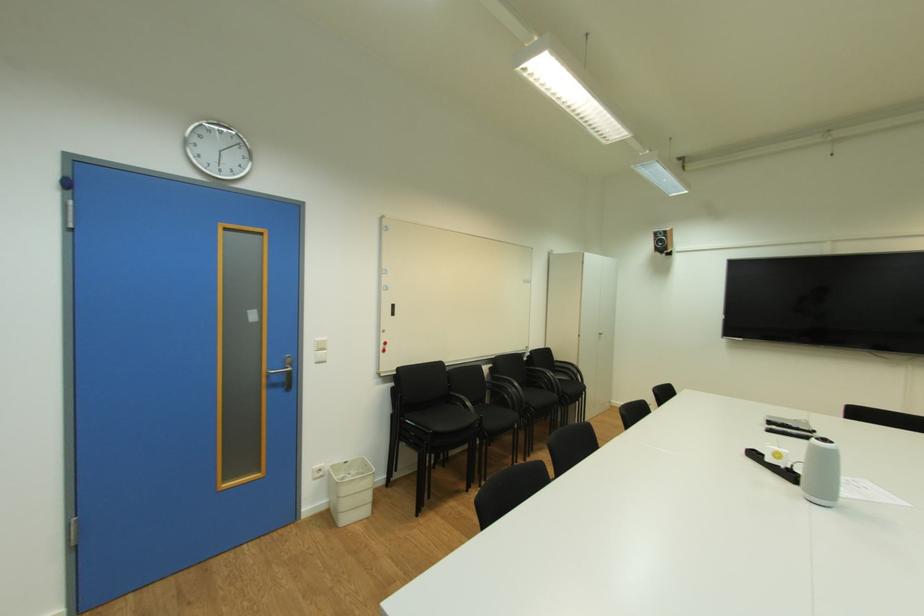
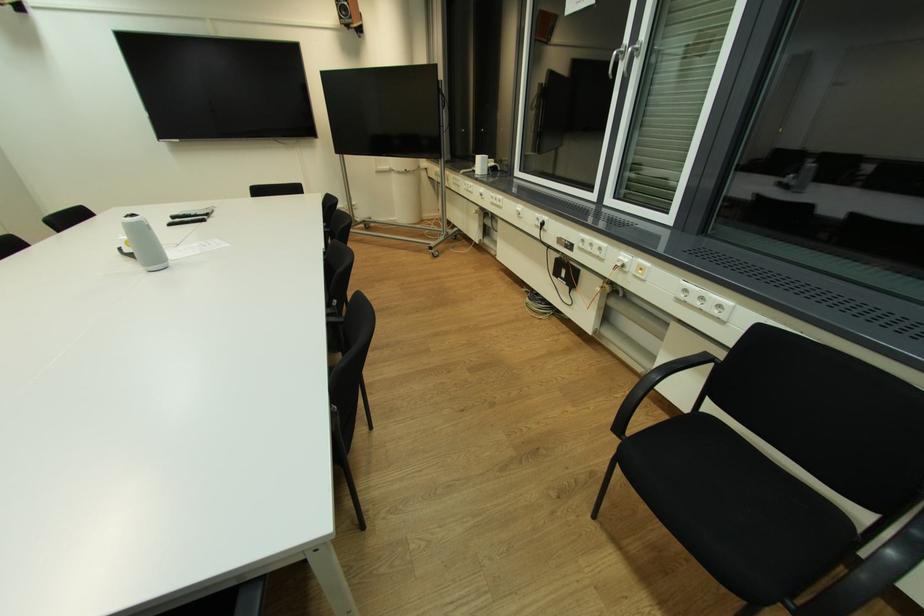
How did the camera likely rotate?

The rotation direction of the camera is right-down.